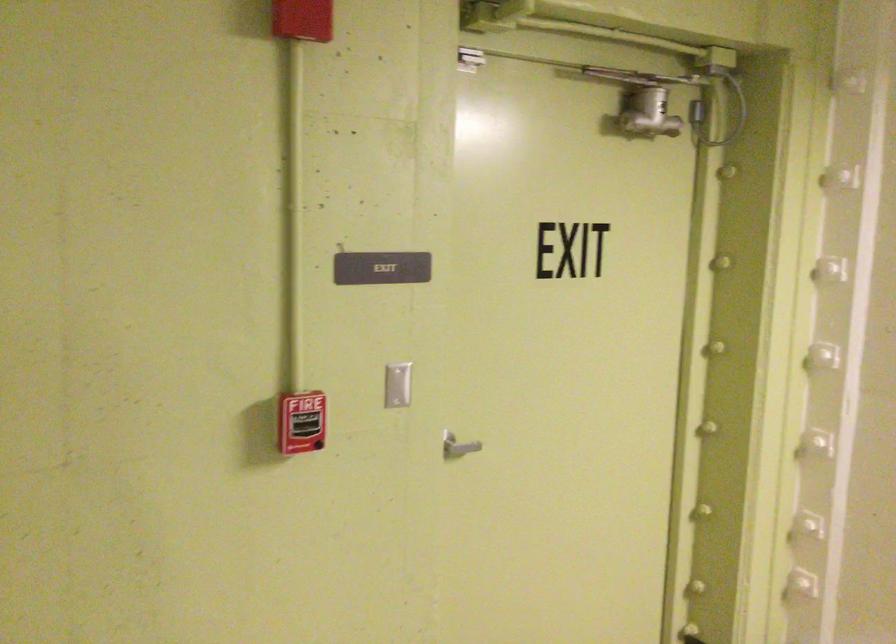
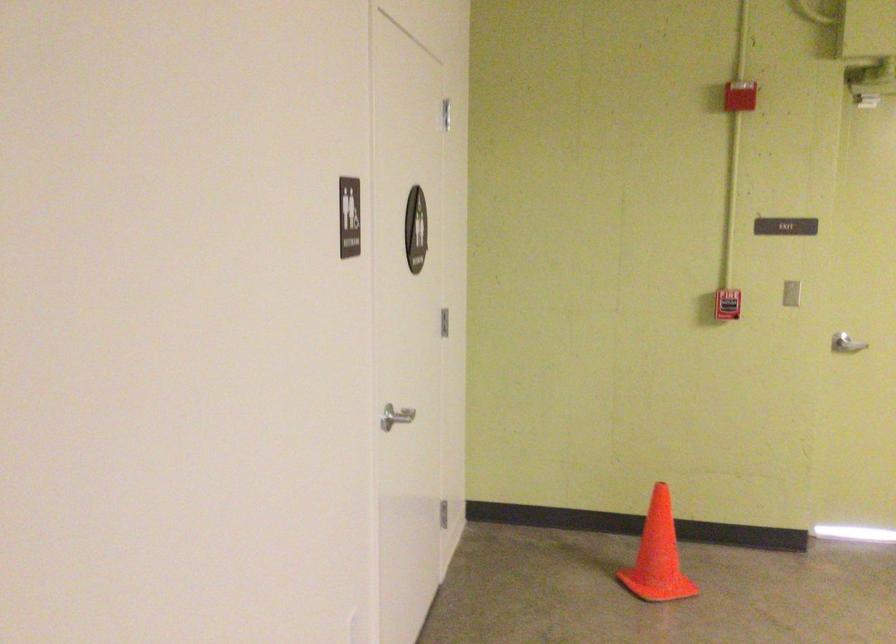
In the second image, find the point that corresponds to (371,386) in the first image.

(790, 292)